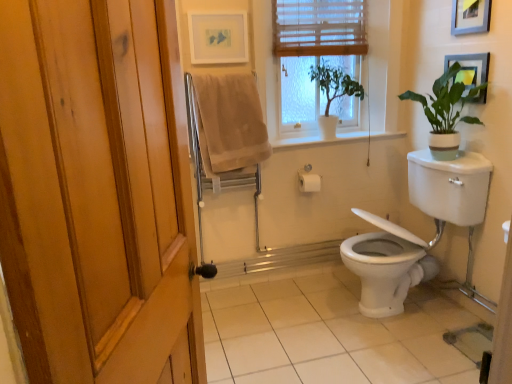
The image size is (512, 384). I want to click on vacant area situated below white glossy toilet at lower right (from a real-world perspective), so click(x=394, y=316).